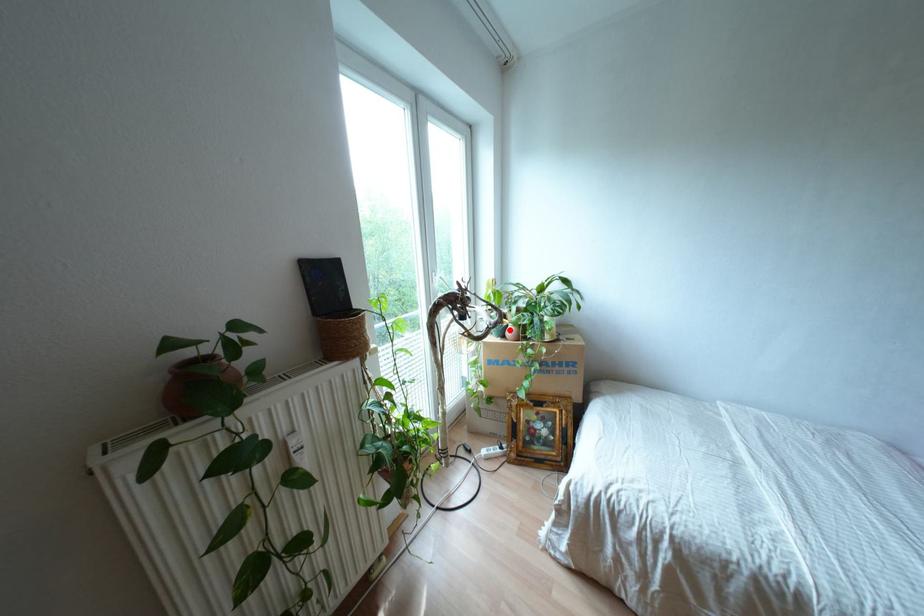
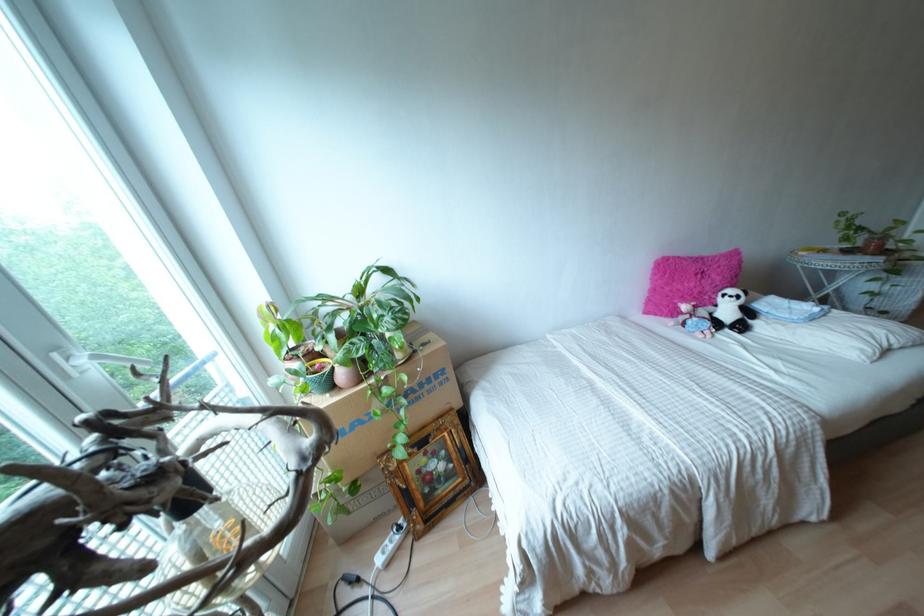
Question: A red point is marked in image1. In image2, is the corresponding 3D point closer to the camera or farther? Reply with the corresponding letter.

Choices:
 (A) The corresponding 3D point is closer.
 (B) The corresponding 3D point is farther.

Answer: (A)